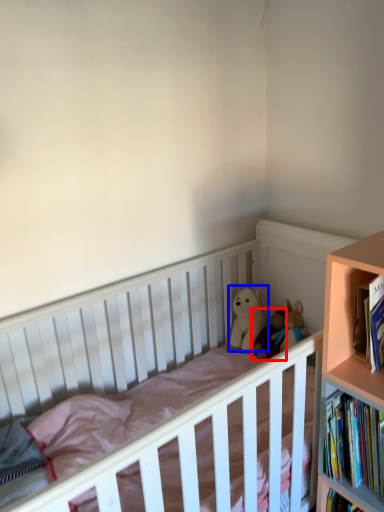
Question: Which object is closer to the camera taking this photo, doll (highlighted by a red box) or doll (highlighted by a blue box)?

Choices:
 (A) doll
 (B) doll

Answer: (A)